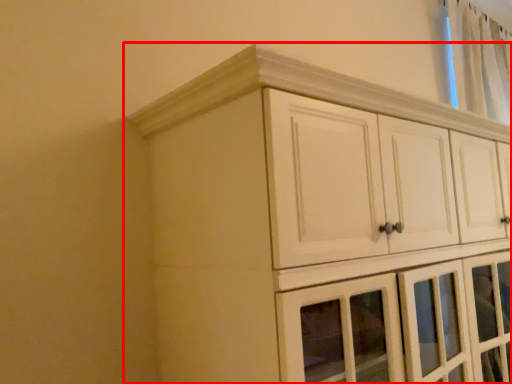
Question: From the image's perspective, what is the correct spatial relationship of cupboard (annotated by the red box) in relation to curtain?

Choices:
 (A) below
 (B) above

Answer: (A)